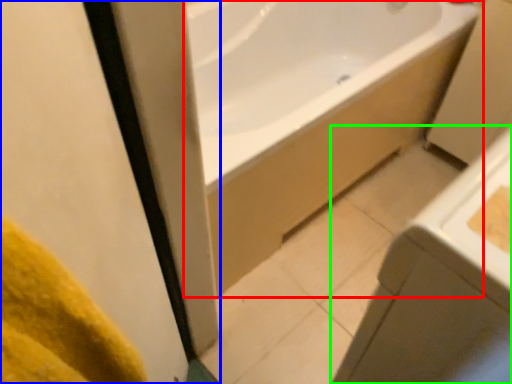
Question: Which object is positioned closest to bathtub (highlighted by a red box)? Select from screen door (highlighted by a blue box) and sink (highlighted by a green box).

Choices:
 (A) screen door
 (B) sink

Answer: (B)